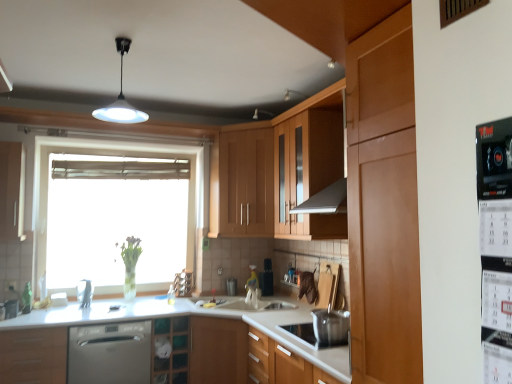
Question: Can you confirm if black plastic toaster at center, which is the second appliance from front to back, is positioned to the right of transparent glass window at center?

Choices:
 (A) no
 (B) yes

Answer: (B)

Question: Can we say black plastic toaster at center, which is the first appliance in back-to-front order, lies outside transparent glass window at center?

Choices:
 (A) yes
 (B) no

Answer: (A)

Question: Is black plastic toaster at center, which is the second appliance in top-to-bottom order, bigger than transparent glass window at center?

Choices:
 (A) yes
 (B) no

Answer: (B)

Question: Considering the relative sizes of black plastic toaster at center, placed as the 1th appliance when sorted from bottom to top, and transparent glass window at center in the image provided, is black plastic toaster at center, placed as the 1th appliance when sorted from bottom to top, shorter than transparent glass window at center?

Choices:
 (A) yes
 (B) no

Answer: (A)

Question: Is black plastic toaster at center, placed as the 1th appliance when sorted from bottom to top, positioned before transparent glass window at center?

Choices:
 (A) no
 (B) yes

Answer: (A)

Question: Does black plastic toaster at center, which is the second appliance from front to back, come behind transparent glass window at center?

Choices:
 (A) no
 (B) yes

Answer: (B)

Question: Is transparent glass window at center outside of black plastic calendar at right, the 1th appliance viewed from the right?

Choices:
 (A) no
 (B) yes

Answer: (B)

Question: From a real-world perspective, is transparent glass window at center positioned over black plastic calendar at right, the 1th appliance viewed from the right, based on gravity?

Choices:
 (A) no
 (B) yes

Answer: (B)

Question: Does transparent glass window at center have a lesser width compared to black plastic calendar at right, acting as the second appliance starting from the back?

Choices:
 (A) no
 (B) yes

Answer: (A)

Question: Does transparent glass window at center have a greater height compared to black plastic calendar at right, placed as the second appliance when sorted from bottom to top?

Choices:
 (A) yes
 (B) no

Answer: (A)

Question: From a real-world perspective, is transparent glass window at center located beneath black plastic calendar at right, acting as the second appliance starting from the back?

Choices:
 (A) no
 (B) yes

Answer: (A)

Question: From the image's perspective, is transparent glass window at center under black plastic calendar at right, acting as the second appliance starting from the left?

Choices:
 (A) yes
 (B) no

Answer: (A)

Question: Is transparent glass window at center to the left of white glossy sink at center from the viewer's perspective?

Choices:
 (A) no
 (B) yes

Answer: (B)